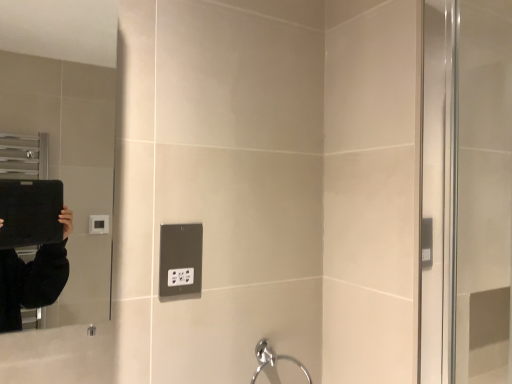
Question: Looking at their shapes, would you say black plastic outlet at center is wider or thinner than chrome metallic faucet at lower center?

Choices:
 (A) wide
 (B) thin

Answer: (B)

Question: From a real-world perspective, is black plastic outlet at center above or below chrome metallic faucet at lower center?

Choices:
 (A) below
 (B) above

Answer: (B)

Question: Based on their relative distances, which object is nearer to the chrome metallic faucet at lower center?

Choices:
 (A) matte black mirror at left
 (B) black plastic outlet at center

Answer: (B)

Question: Considering the real-world distances, which object is farthest from the black plastic outlet at center?

Choices:
 (A) matte black mirror at left
 (B) chrome metallic faucet at lower center

Answer: (A)